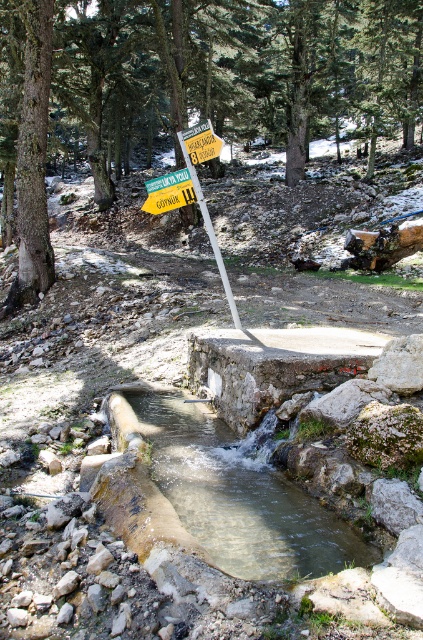
You are a hiker walking along the water channel and want to read the yellow plastic signpost at center. Which direction should you move relative to the brown rough tree at upper center to get closer to the signpost?

The brown rough tree at upper center is positioned on the left side of the yellow plastic signpost at center. To get closer to the signpost, you should move to the right relative to the brown rough tree at upper center.

You are standing at the signpost near the water channel. Looking towards the upper center of the scene, can you see the brown rough tree at upper center? Please state its coordinates as per the image grid system.

Yes, the brown rough tree at upper center is located at coordinates point (200, 84).

You are standing at the signpost near the water channel. You want to cross the stream using the curved pipe. Is the clear water at stream center flowing towards or away from the pipe?

The clear water at stream center flows away from the pipe because the water exits the concrete structure through the rectangular opening, creating a small waterfall effect, indicating the water flows downstream away from the pipe.